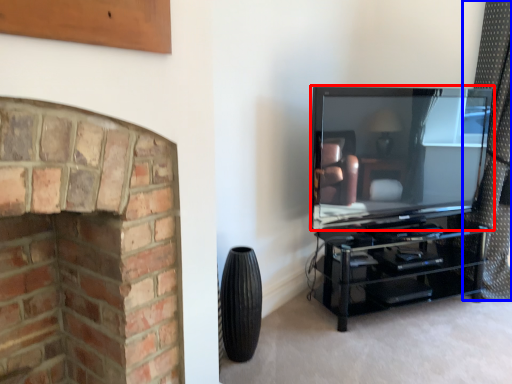
Question: Which object is further to the camera taking this photo, television (highlighted by a red box) or curtain (highlighted by a blue box)?

Choices:
 (A) television
 (B) curtain

Answer: (B)